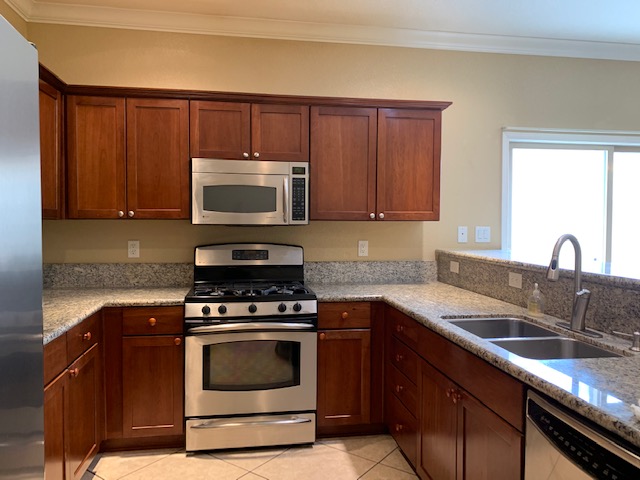
Find the location of a particular element. dish washer is located at coordinates (544, 466).